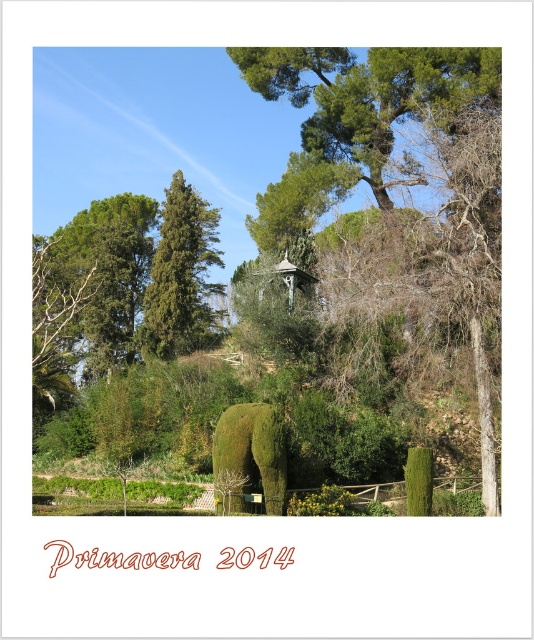
Question: Which point is closer to the camera?

Choices:
 (A) green leafy tree at upper left
 (B) green textured tree at center
 (C) green leafy tree at center
 (D) green mossy elephant at center

Answer: (D)

Question: Is green textured tree at center further to the viewer compared to green mossy elephant at center?

Choices:
 (A) no
 (B) yes

Answer: (B)

Question: Considering the real-world distances, which object is closest to the green textured tree at center?

Choices:
 (A) green mossy elephant at center
 (B) green leafy tree at center
 (C) green leafy tree at upper left

Answer: (C)

Question: Is green textured tree at center below green mossy elephant at center?

Choices:
 (A) no
 (B) yes

Answer: (A)

Question: Among these objects, which one is nearest to the camera?

Choices:
 (A) green mossy elephant at center
 (B) green textured tree at center
 (C) green leafy tree at upper left

Answer: (A)

Question: Can you confirm if green leafy tree at upper left is wider than green textured tree at center?

Choices:
 (A) no
 (B) yes

Answer: (B)